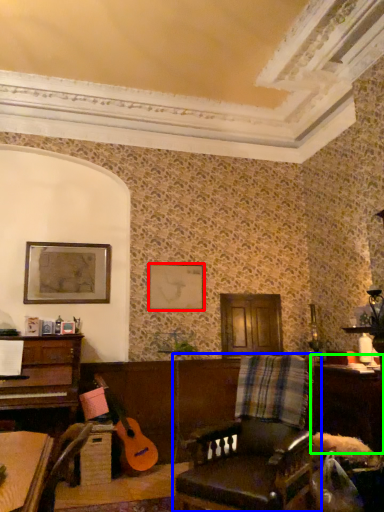
Question: Based on their relative distances, which object is nearer to picture frame (highlighted by a red box)? Choose from chair (highlighted by a blue box) and table (highlighted by a green box).

Choices:
 (A) chair
 (B) table

Answer: (B)